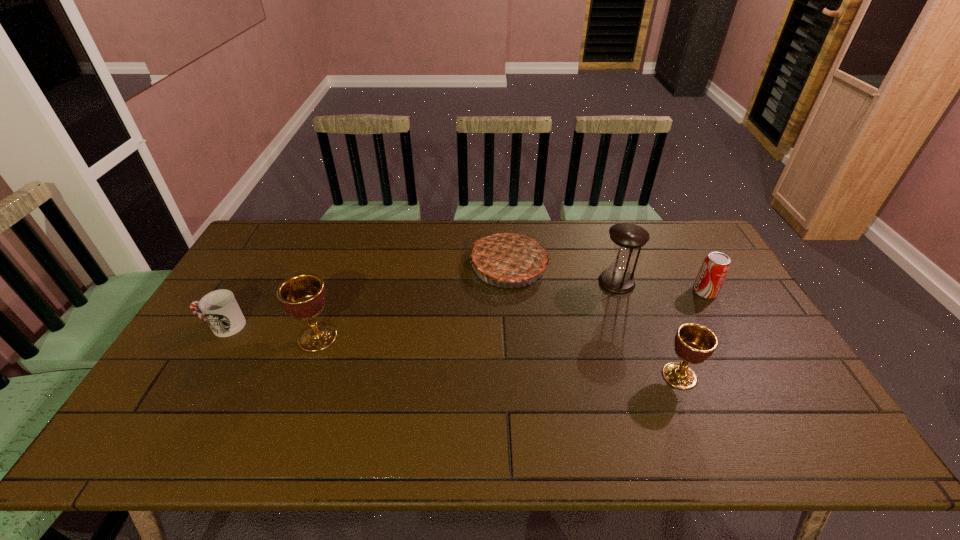
Identify the location of vacant position for inserting another chalice evenly. This screenshot has height=540, width=960. (491, 356).